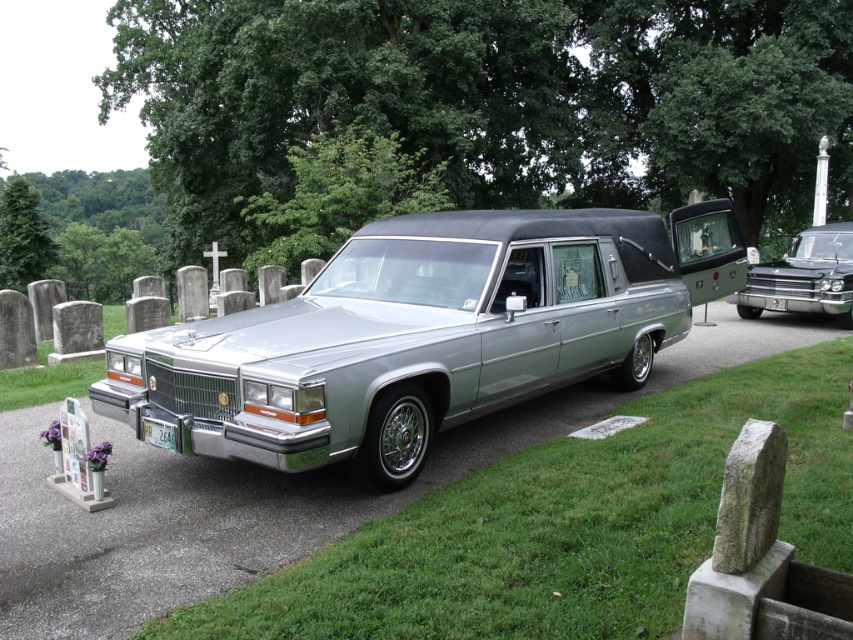
Question: In this image, where is metallic silver hearse at center located relative to green matte license plate at lower center?

Choices:
 (A) left
 (B) right

Answer: (B)

Question: Which object is the farthest from the green matte license plate at lower center?

Choices:
 (A) silver metallic hearse at center
 (B) metallic silver hearse at center

Answer: (B)

Question: Does silver metallic hearse at center appear on the right side of green matte license plate at lower center?

Choices:
 (A) yes
 (B) no

Answer: (A)

Question: Which of the following is the farthest from the observer?

Choices:
 (A) (813, 228)
 (B) (152, 428)
 (C) (720, 262)

Answer: (A)

Question: Where is silver metallic hearse at center located in relation to green matte license plate at lower center in the image?

Choices:
 (A) right
 (B) left

Answer: (A)

Question: Considering the real-world distances, which object is closest to the green matte license plate at lower center?

Choices:
 (A) silver metallic hearse at center
 (B) metallic silver hearse at center

Answer: (A)